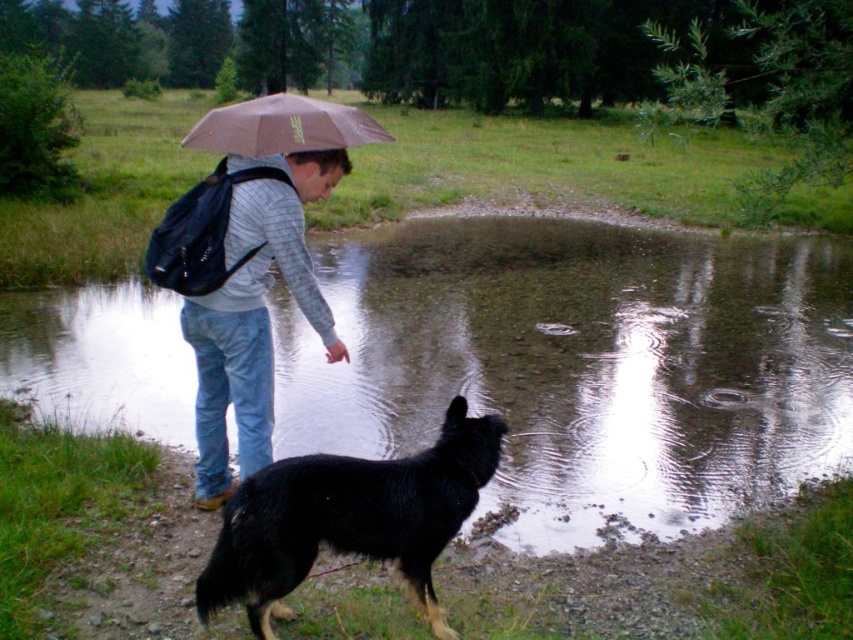
You are an AI analyzing the scene. The coordinates given are in a normalized system where the bottom left corner is the origin point. The first number is the x coordinate and the second is the y coordinate. The x coordinate increases to the right and the y coordinate increases upwards. If the scene is viewed from above, where would the matte gray sweater at center be located in relation to the edges of the image? Please answer with the position in terms of left, right, top, bottom, and center areas.

The matte gray sweater at center is located near the center of the image since its coordinates are approximately 0.491 on the x axis and 0.299 on the y axis. The x coordinate of 0.491 is very close to the center horizontally, while the y coordinate of 0.299 places it slightly lower than the vertical center. However, given the description of the sweater being at center, it is safe to conclude it is positioned in the central area of the image.

You are a photographer trying to capture the black shaggy dog at lower center and the matte gray sweater at center in a single shot. Based on their positions, will the dog appear closer to the camera than the sweater in the photo?

The black shaggy dog at lower center is in front of matte gray sweater at center, so yes, the dog will appear closer to the camera than the sweater in the photo.

You are standing at the edge of the pond and want to toss a stick to the black shaggy dog at lower center. If you can throw the stick 3 meters, will the dog be able to reach it?

The black shaggy dog at lower center and viewer are 3.33 meters apart. Since the throwing distance is 3 meters, the dog cannot reach the stick as the distance is slightly longer than the throwing range.